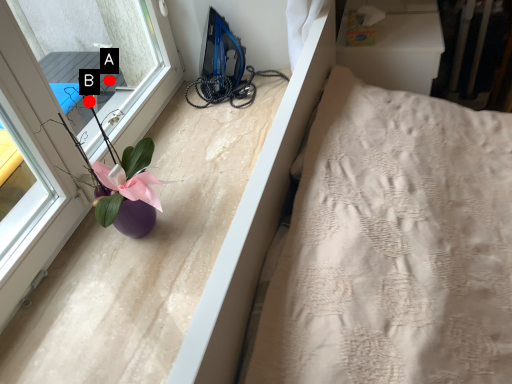
Question: Two points are circled on the image, labeled by A and B beside each circle. Which point is closer to the camera taking this photo?

Choices:
 (A) A is closer
 (B) B is closer

Answer: (B)